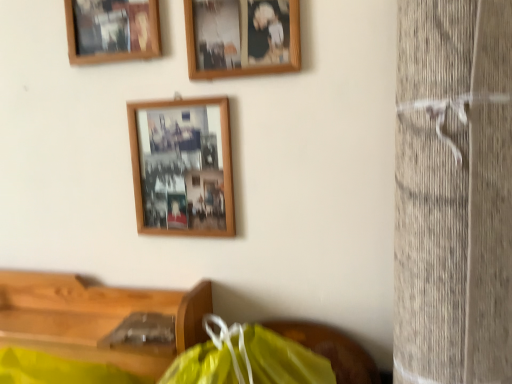
Question: Considering the positions of wooden picture frame at upper left, acting as the 1th picture frame starting from the top, and wooden photo frame at center, which appears as the third picture frame when viewed from the top, in the image, is wooden picture frame at upper left, acting as the 1th picture frame starting from the top, taller or shorter than wooden photo frame at center, which appears as the third picture frame when viewed from the top,?

Choices:
 (A) tall
 (B) short

Answer: (A)

Question: Considering the positions of wooden picture frame at upper left, positioned as the 3th picture frame in bottom-to-top order, and wooden photo frame at center, the first picture frame positioned from the bottom, in the image, is wooden picture frame at upper left, positioned as the 3th picture frame in bottom-to-top order, wider or thinner than wooden photo frame at center, the first picture frame positioned from the bottom,?

Choices:
 (A) thin
 (B) wide

Answer: (A)

Question: Which is nearer to the wooden photo frame at upper center, the second picture frame when ordered from top to bottom?

Choices:
 (A) wooden photo frame at center, which appears as the third picture frame when viewed from the top
 (B) wooden picture frame at upper left, positioned as the 3th picture frame in bottom-to-top order
 (C) wooden table at lower left

Answer: (A)

Question: Which of these objects is positioned farthest from the wooden picture frame at upper left, positioned as the 3th picture frame in bottom-to-top order?

Choices:
 (A) wooden photo frame at center, which appears as the third picture frame when viewed from the top
 (B) wooden photo frame at upper center, the second picture frame when ordered from top to bottom
 (C) wooden table at lower left

Answer: (C)